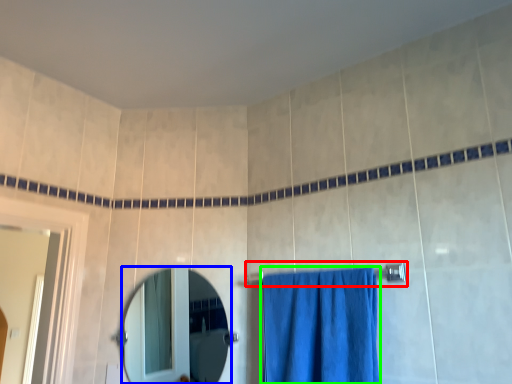
Question: Which object is positioned farthest from towel bar (highlighted by a red box)? Select from mirror (highlighted by a blue box) and curtain (highlighted by a green box).

Choices:
 (A) mirror
 (B) curtain

Answer: (A)